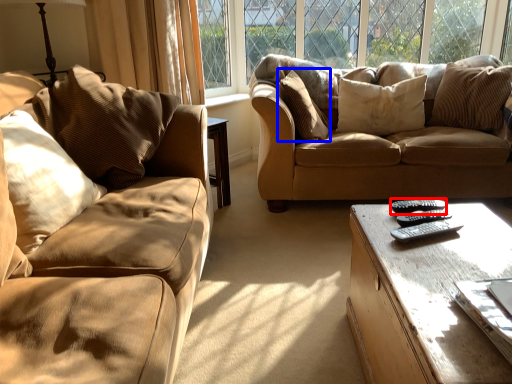
Question: Which of the following is the closest to the observer, remote (highlighted by a red box) or pillow (highlighted by a blue box)?

Choices:
 (A) remote
 (B) pillow

Answer: (A)